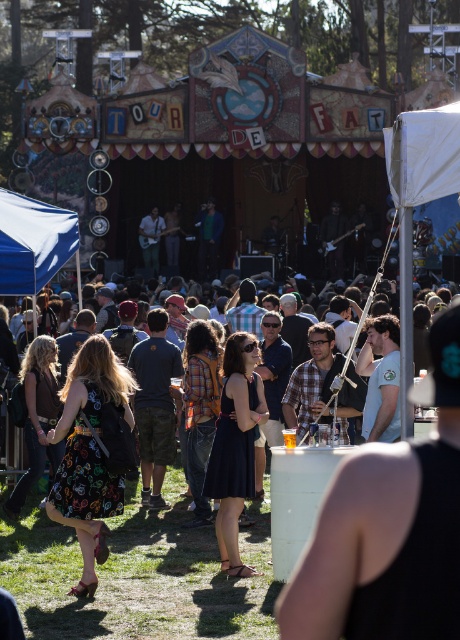
You are a photographer at the festival and want to capture a photo that includes both the dark blue dress at center and the blue fabric canopy at upper left. Which object should you position closer to the edge of the frame to ensure both fit in the shot?

Since the dark blue dress at center is narrower than the blue fabric canopy at upper left, you should position the blue fabric canopy at upper left closer to the edge of the frame to ensure both fit in the shot.